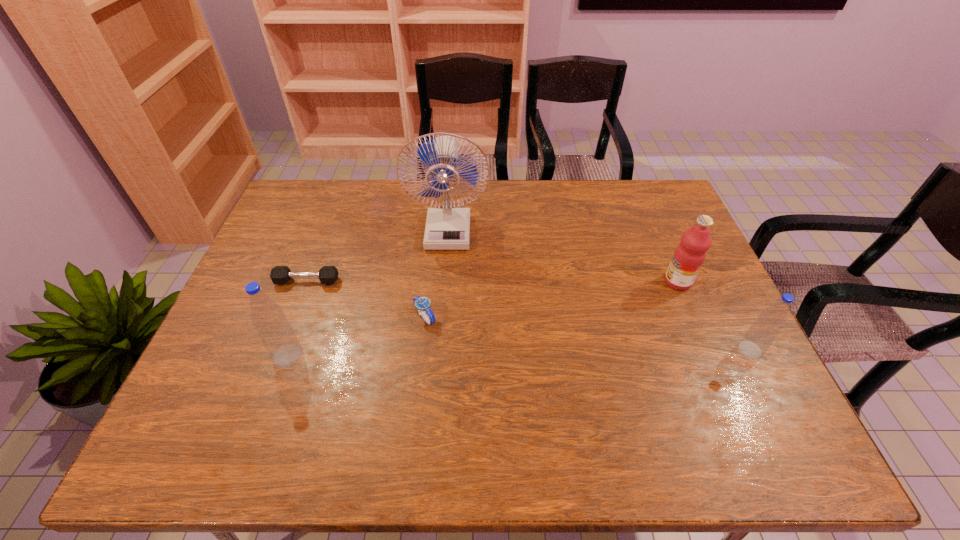
In order to click on fruit juice at the right edge in this screenshot , I will do `click(690, 254)`.

Where is `vacant space at the far edge`? The image size is (960, 540). vacant space at the far edge is located at coordinates (537, 199).

Find the location of a particular element. vacant space at the near edge of the desktop is located at coordinates (459, 390).

The height and width of the screenshot is (540, 960). In the image, there is a desktop. Find the location of `vacant area at the left edge`. vacant area at the left edge is located at coordinates (231, 313).

This screenshot has height=540, width=960. What are the coordinates of `vacant region at the right edge of the desktop` in the screenshot? It's located at (678, 322).

The height and width of the screenshot is (540, 960). I want to click on blank area at the far left corner, so click(x=280, y=217).

At what (x,y) coordinates should I click in order to perform the action: click on vacant point located between the watch and the taller water bottle. Please return your answer as a coordinate pair (x, y). Image resolution: width=960 pixels, height=540 pixels. Looking at the image, I should click on pyautogui.click(x=356, y=336).

At what (x,y) coordinates should I click in order to perform the action: click on free point between the fifth object from left to right and the dumbbell. Please return your answer as a coordinate pair (x, y). Image resolution: width=960 pixels, height=540 pixels. Looking at the image, I should click on (492, 281).

Where is `vacant space that is in between the farthest object and the taller water bottle`? vacant space that is in between the farthest object and the taller water bottle is located at coordinates (368, 292).

The height and width of the screenshot is (540, 960). In order to click on free space between the rightmost object and the fruit juice in this screenshot , I will do `click(714, 316)`.